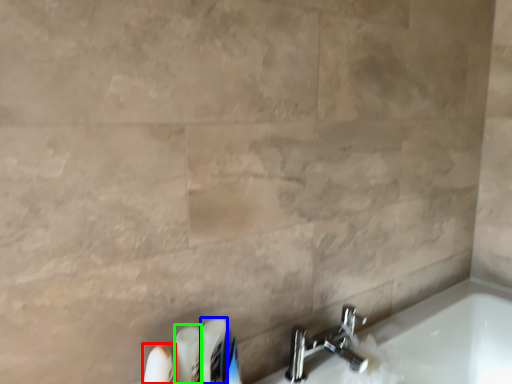
Question: Which object is the closest to the toiletry (highlighted by a red box)? Choose among these: toiletry (highlighted by a blue box) or toiletry (highlighted by a green box).

Choices:
 (A) toiletry
 (B) toiletry

Answer: (B)